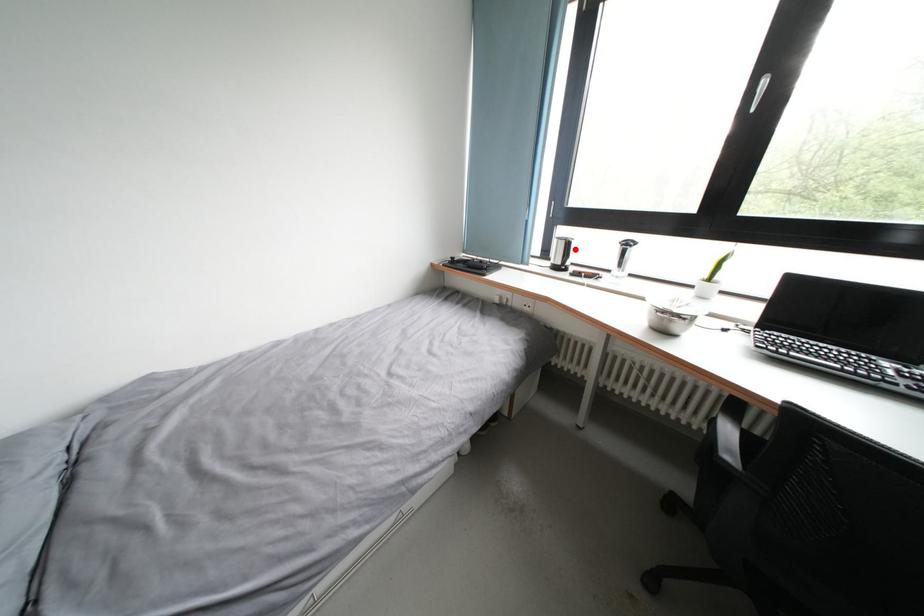
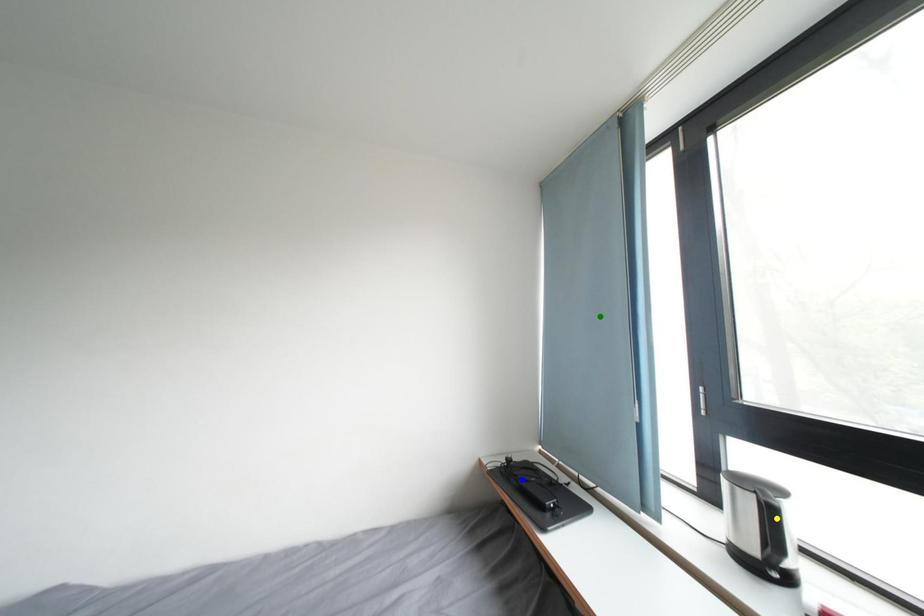
Question: I am providing you with two images of the same scene from different viewpoints. A red point is marked on the first image. You are given multiple points on the second image. Which point in image 2 represents the same 3d spot as the red point in image 1?

Choices:
 (A) green point
 (B) yellow point
 (C) blue point

Answer: (B)